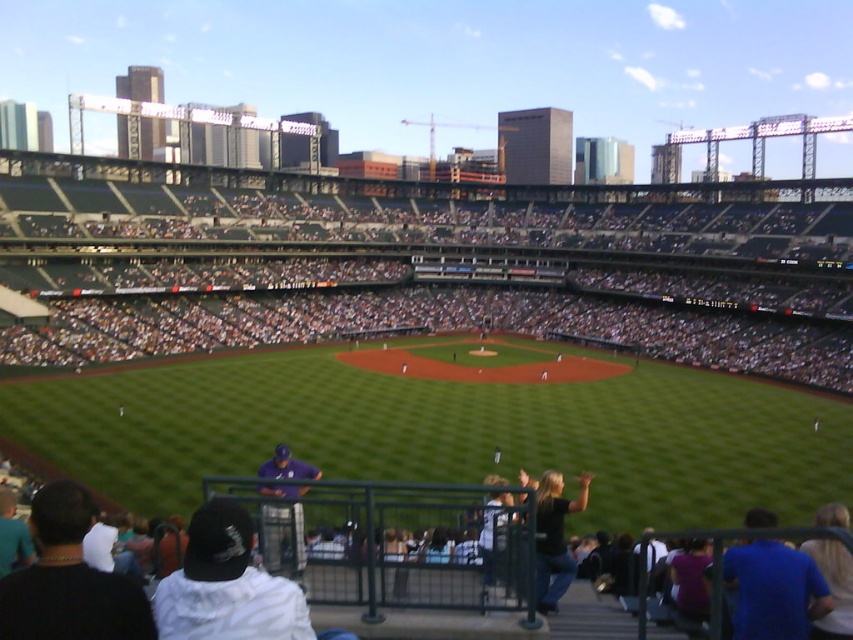
Who is more distant from viewer, (358, 282) or (277, 515)?

The point (358, 282) is behind.

Does point (86, 291) come in front of point (296, 547)?

No, it is behind (296, 547).

Identify the location of dark gray seats at upper center. This screenshot has width=853, height=640. (421, 276).

Is dark blue baseball cap at lower left to the left of white fabric cap at lower left from the viewer's perspective?

Correct, you'll find dark blue baseball cap at lower left to the left of white fabric cap at lower left.

Between dark blue baseball cap at lower left and white fabric cap at lower left, which one is positioned lower?

Positioned lower is white fabric cap at lower left.

The height and width of the screenshot is (640, 853). In order to click on dark blue baseball cap at lower left in this screenshot , I will do `click(68, 579)`.

Can you confirm if dark blue baseball cap at lower left is positioned below purple fabric shirt at lower center?

No, dark blue baseball cap at lower left is not below purple fabric shirt at lower center.

Can you confirm if dark blue baseball cap at lower left is positioned to the right of purple fabric shirt at lower center?

No, dark blue baseball cap at lower left is not to the right of purple fabric shirt at lower center.

The image size is (853, 640). What do you see at coordinates (68, 579) in the screenshot?
I see `dark blue baseball cap at lower left` at bounding box center [68, 579].

I want to click on dark blue baseball cap at lower left, so click(68, 579).